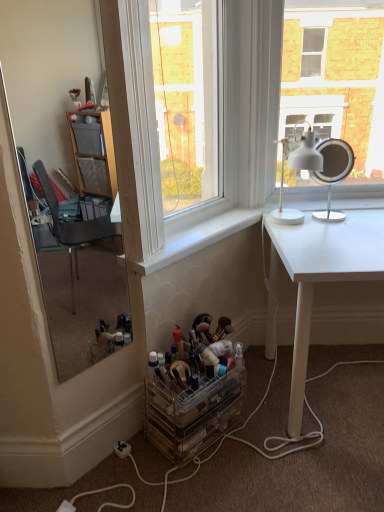
Where is `free space on the front side of clear acrylic makeup organizer at lower center`? free space on the front side of clear acrylic makeup organizer at lower center is located at coordinates (203, 484).